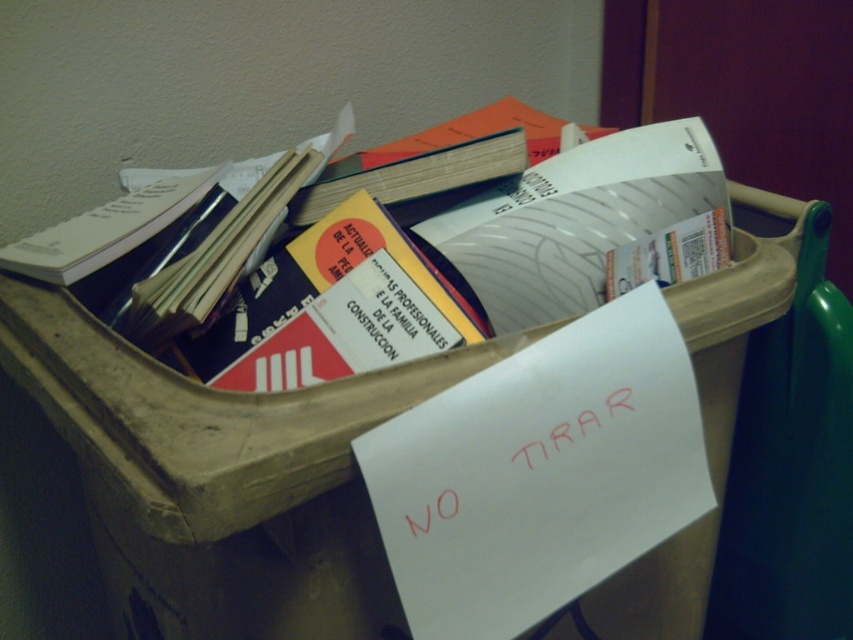
You are organizing a desk and see the white glossy paper at center and the white paper book at upper left. Which one is taller?

The white glossy paper at center is taller than the white paper book at upper left.

You are organizing the books on the desk. You have to place the white paper book at upper left and the hardcover book at center into a shelf that can only hold items up to 2 inches thick. Which book should you prioritize placing first to ensure both fit?

The white paper book at upper left is thinner than the hardcover book at center, so you should place the hardcover book at center first to ensure there is enough space for both.

You are organizing the items on the desk. You need to move the white paper book at upper left and the hardcover book at center to a new shelf. Which book should you move first if you want to start with the one nearest to you?

You should move the white paper book at upper left first because it is closer to the viewer than the hardcover book at center.